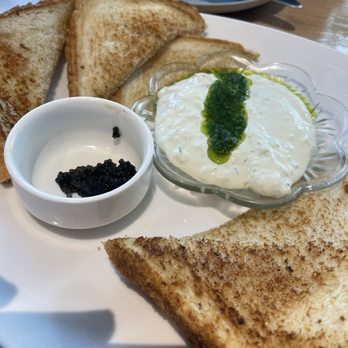
At what (x,y) coordinates should I click in order to perform the action: click on white plate. Please return your answer as a coordinate pair (x, y). The width and height of the screenshot is (348, 348). Looking at the image, I should click on (324, 68), (65, 276).